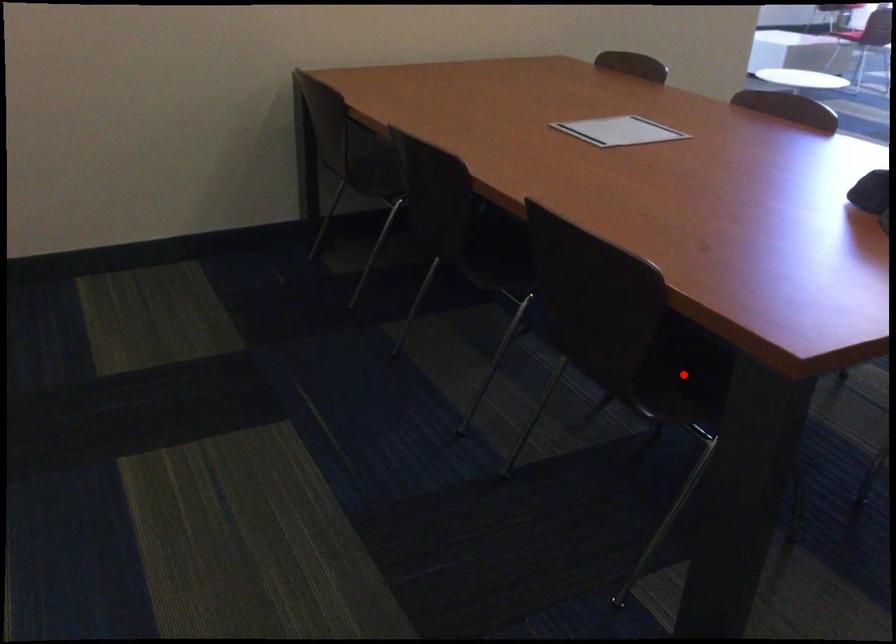
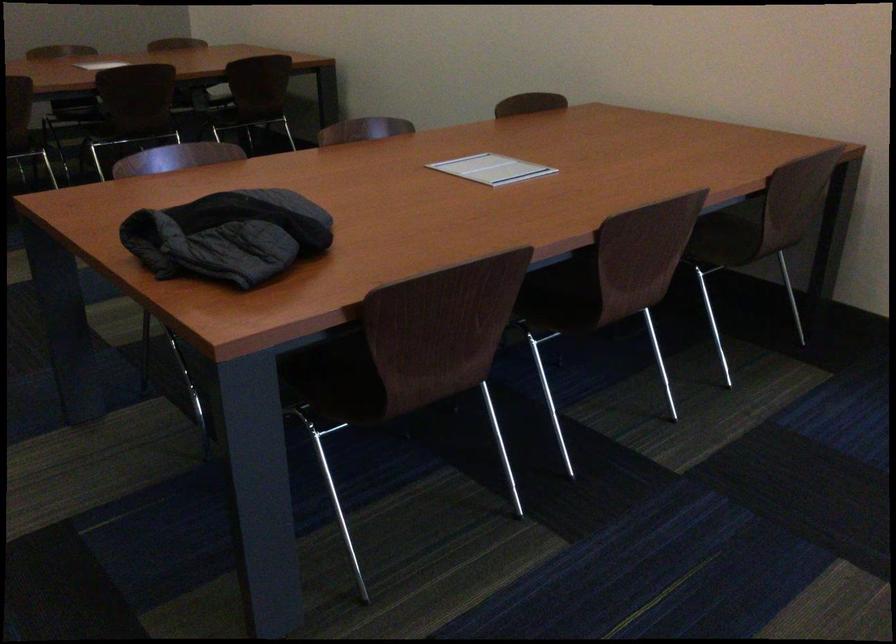
Question: I am providing you with two images of the same scene from different viewpoints. A red point is marked on the first image. At the location where the point appears in image 1, is it still visible in image 2?

Choices:
 (A) Yes
 (B) No

Answer: (B)